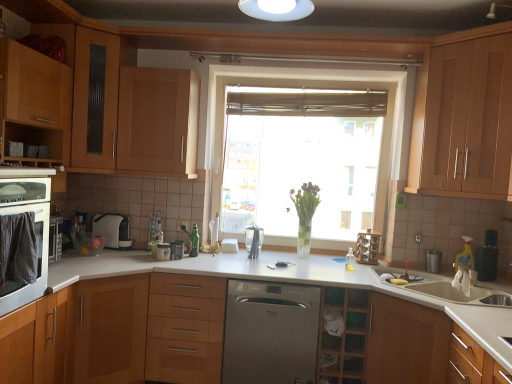
Locate an element on the screen. The image size is (512, 384). blank space to the left of green plastic faucet at center is located at coordinates [177, 255].